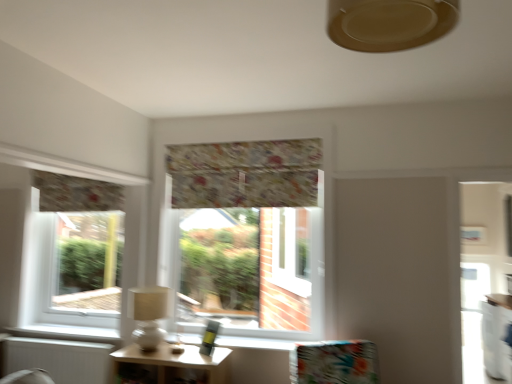
Question: From the image's perspective, is wooden table at lower center under floral fabric valance at center, which is the first window in right-to-left order?

Choices:
 (A) no
 (B) yes

Answer: (B)

Question: Is wooden table at lower center shorter than floral fabric valance at center, the second window positioned from the left?

Choices:
 (A) no
 (B) yes

Answer: (B)

Question: Can you confirm if wooden table at lower center is wider than floral fabric valance at center, which is the first window in right-to-left order?

Choices:
 (A) no
 (B) yes

Answer: (B)

Question: From a real-world perspective, is wooden table at lower center beneath floral fabric valance at center, which is the first window in right-to-left order?

Choices:
 (A) yes
 (B) no

Answer: (A)

Question: Is wooden table at lower center smaller than floral fabric valance at center, the second window positioned from the left?

Choices:
 (A) no
 (B) yes

Answer: (B)

Question: In terms of width, does beige matte ceiling fan at upper center look wider or thinner when compared to floral fabric cushion at center?

Choices:
 (A) wide
 (B) thin

Answer: (B)

Question: From a real-world perspective, is beige matte ceiling fan at upper center positioned above or below floral fabric cushion at center?

Choices:
 (A) above
 (B) below

Answer: (A)

Question: From the image's perspective, is beige matte ceiling fan at upper center above or below floral fabric cushion at center?

Choices:
 (A) below
 (B) above

Answer: (B)

Question: Which is correct: beige matte ceiling fan at upper center is inside floral fabric cushion at center, or outside of it?

Choices:
 (A) inside
 (B) outside

Answer: (B)

Question: From a real-world perspective, is beige fabric lampshade at left above or below wooden table at lower center?

Choices:
 (A) below
 (B) above

Answer: (B)

Question: Considering the positions of beige fabric lampshade at left and wooden table at lower center in the image, is beige fabric lampshade at left wider or thinner than wooden table at lower center?

Choices:
 (A) thin
 (B) wide

Answer: (A)

Question: In terms of size, does beige fabric lampshade at left appear bigger or smaller than wooden table at lower center?

Choices:
 (A) big
 (B) small

Answer: (B)

Question: Considering their positions, is beige fabric lampshade at left located in front of or behind wooden table at lower center?

Choices:
 (A) front
 (B) behind

Answer: (B)

Question: In terms of size, does wooden table at lower center appear bigger or smaller than floral fabric valance at center, the second window positioned from the left?

Choices:
 (A) big
 (B) small

Answer: (B)

Question: Based on their positions, is wooden table at lower center located to the left or right of floral fabric valance at center, which is the first window in right-to-left order?

Choices:
 (A) left
 (B) right

Answer: (A)